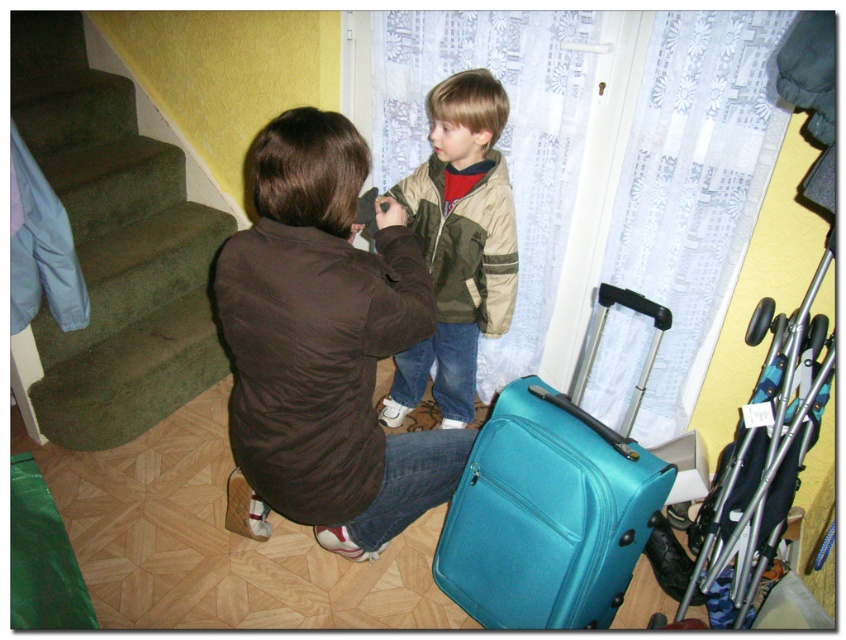
Question: Which point is farther from the camera taking this photo?

Choices:
 (A) (512, 588)
 (B) (235, 262)
 (C) (143, 141)
 (D) (467, 264)

Answer: (C)

Question: Is brown fabric jacket at center to the right of khaki-green jacket at center from the viewer's perspective?

Choices:
 (A) no
 (B) yes

Answer: (A)

Question: Which object appears closest to the camera in this image?

Choices:
 (A) brown fabric jacket at center
 (B) teal matte suitcase at lower center
 (C) khaki-green jacket at center

Answer: (A)

Question: Can you confirm if brown fabric jacket at center is bigger than green carpeted stairs at left?

Choices:
 (A) no
 (B) yes

Answer: (A)

Question: Which object appears farthest from the camera in this image?

Choices:
 (A) khaki-green jacket at center
 (B) teal matte suitcase at lower center

Answer: (A)

Question: Observing the image, what is the correct spatial positioning of teal matte suitcase at lower center in reference to khaki-green jacket at center?

Choices:
 (A) above
 (B) below

Answer: (B)